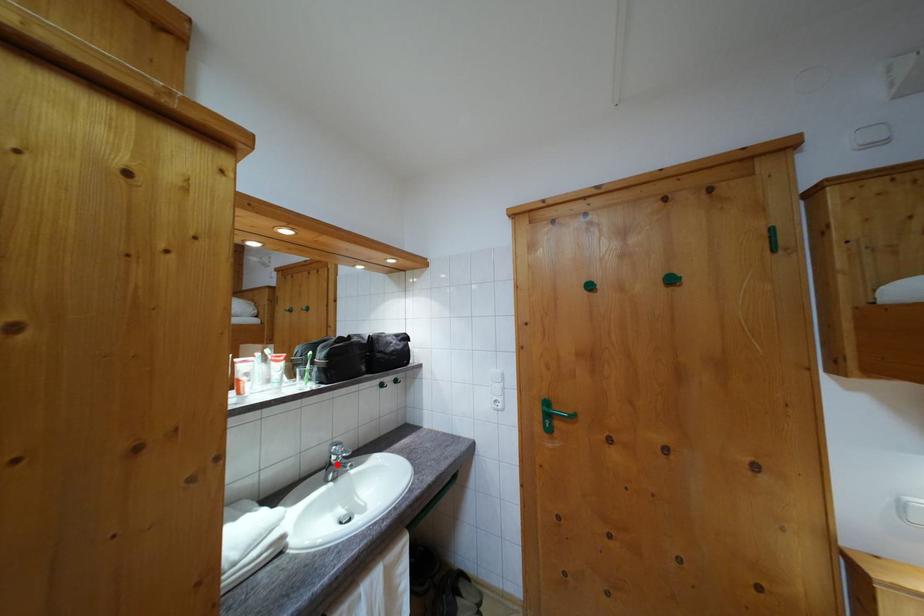
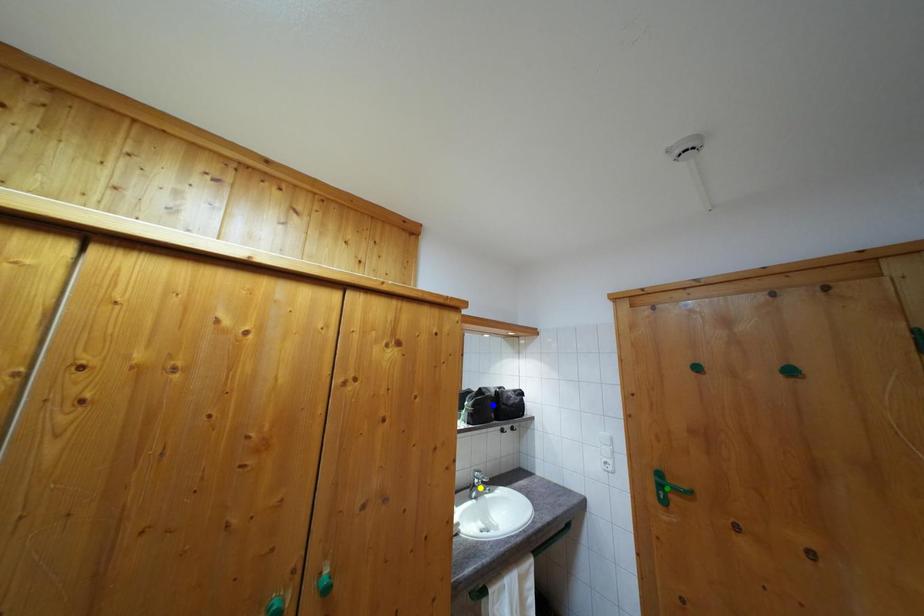
Question: I am providing you with two images of the same scene from different viewpoints. A red point is marked on the first image. You are given multiple points on the second image. Which mark in image 2 goes with the point in image 1?

Choices:
 (A) green point
 (B) yellow point
 (C) blue point

Answer: (B)